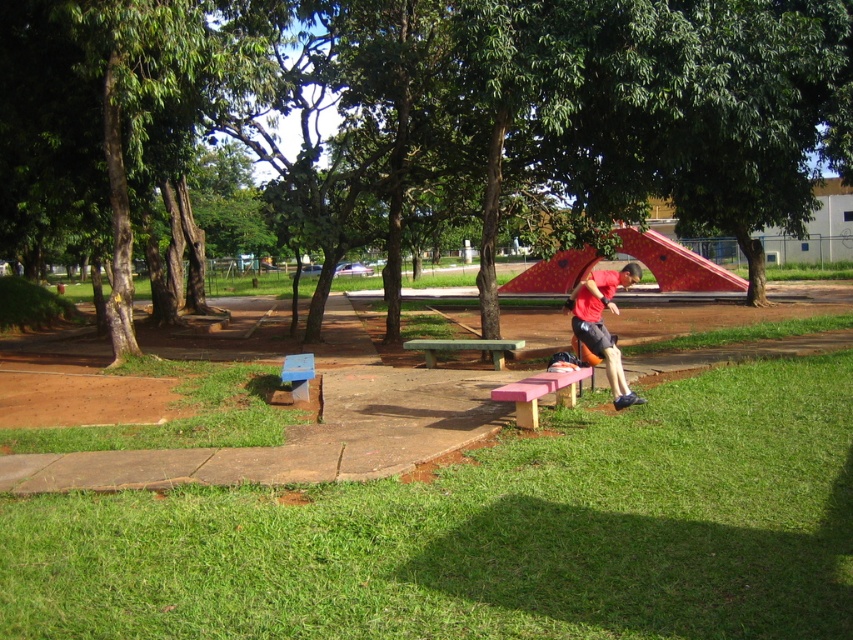
You are planning to place a new bench in the park. The current blue plastic bench at lower left is narrower than the green leafy tree at center. If you want the new bench to be wider than the existing one but not wider than the tree, what is the maximum width you can design it to be?

The maximum width for the new bench should be just under the width of the green leafy tree at center, as the green leafy tree at center is wider than the blue plastic bench at lower left.

You are standing in the park and see the matte red shirt at center and the green wooden bench at center. Which object is closer to you?

The matte red shirt at center is closer to you because it is in front of the green wooden bench at center.

You are planning to set up a picnic in the park and want to ensure there is enough space between the green leafy tree at center and the green wooden bench at center. Based on the scene description, can you determine if the tree is wider than the bench?

The green leafy tree at center is wider than the green wooden bench at center according to the description.